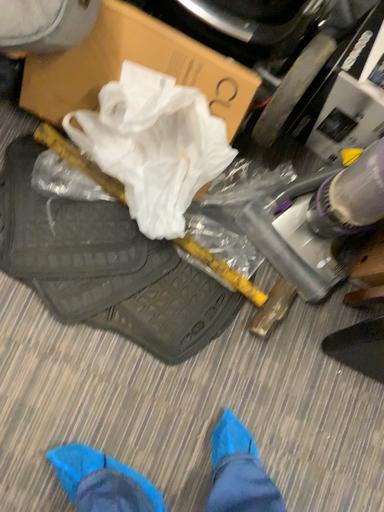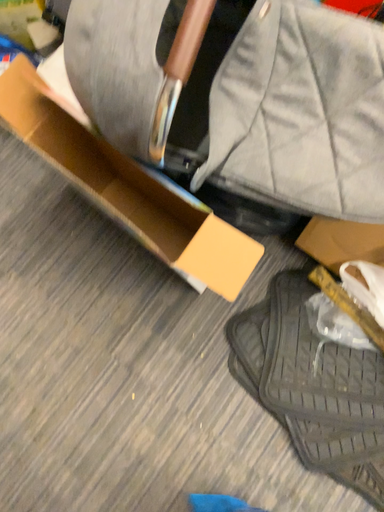
Question: Which way did the camera rotate in the video?

Choices:
 (A) rotated upward
 (B) rotated downward

Answer: (A)